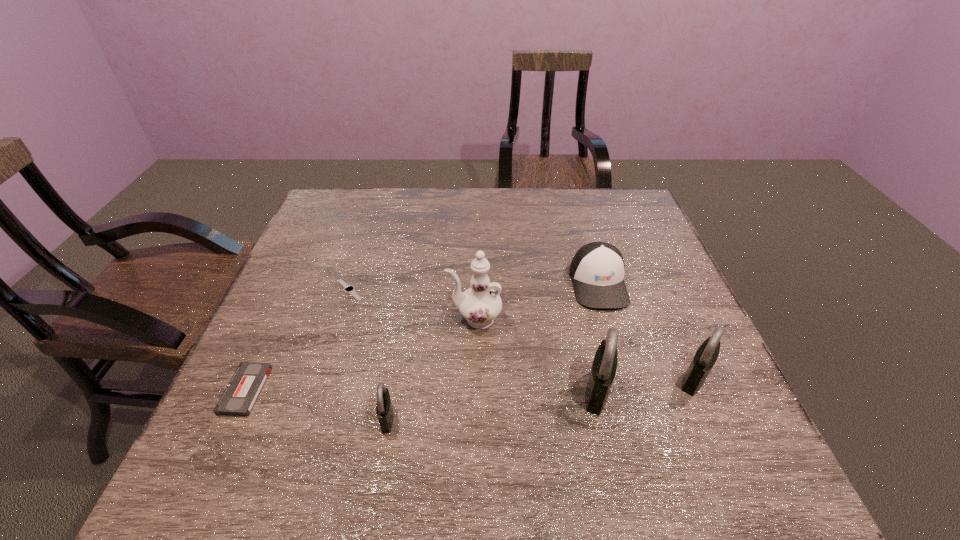
This screenshot has height=540, width=960. I want to click on vacant space that's between the cap and the third tallest object, so click(x=646, y=331).

I want to click on free space between the fourth object from left to right and the sixth object from right to left, so click(412, 305).

Find the location of a particular element. free space between the cap and the second shortest padlock is located at coordinates [x=646, y=331].

You are a GUI agent. You are given a task and a screenshot of the screen. Output one action in this format:
    pyautogui.click(x=<x>, y=<y>)
    Task: Click on the vacant area that lies between the second padlock from left to right and the leftmost padlock
    This screenshot has width=960, height=540.
    Given the screenshot: What is the action you would take?
    pyautogui.click(x=492, y=404)

Identify the location of empty space between the rightmost padlock and the tallest object. This screenshot has height=540, width=960. (585, 349).

Where is `object that is the fifth closest to the shortest padlock`? This screenshot has height=540, width=960. object that is the fifth closest to the shortest padlock is located at coordinates (597, 270).

Point out which object is positioned as the third nearest to the tallest object. Please provide its 2D coordinates. Your answer should be formatted as a tuple, i.e. [(x, y)], where the tuple contains the x and y coordinates of a point satisfying the conditions above.

[(384, 409)]

The height and width of the screenshot is (540, 960). I want to click on padlock that is the closest to the second padlock from left to right, so click(706, 355).

Point out which padlock is positioned as the nearest to the third tallest object. Please provide its 2D coordinates. Your answer should be formatted as a tuple, i.e. [(x, y)], where the tuple contains the x and y coordinates of a point satisfying the conditions above.

[(604, 366)]

Locate an element on the screen. vacant space that satisfies the following two spatial constraints: 1. on the back side of the second padlock from left to right; 2. at the spout of the tallest object is located at coordinates (581, 319).